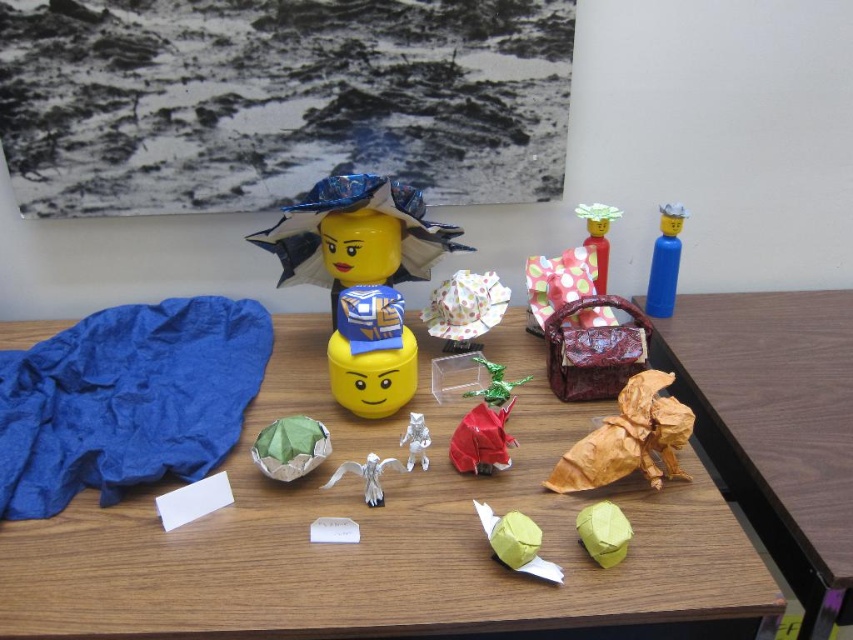
Is gold paper sculpture at right closer to the viewer compared to matte yellow paper ball at lower center?

That is True.

Is gold paper sculpture at right behind matte yellow paper ball at lower center?

No, gold paper sculpture at right is in front of matte yellow paper ball at lower center.

I want to click on gold paper sculpture at right, so pyautogui.click(x=776, y=426).

Locate an element on the screen. This screenshot has width=853, height=640. gold paper sculpture at right is located at coordinates (776, 426).

Does gold paper sculpture at right come in front of matte green paper at center?

Yes, gold paper sculpture at right is closer to the viewer.

Is point (798, 378) less distant than point (485, 513)?

No, (798, 378) is further to viewer.

Does point (827, 378) come in front of point (486, 532)?

No.

Where is `gold paper sculpture at right`? Image resolution: width=853 pixels, height=640 pixels. gold paper sculpture at right is located at coordinates (776, 426).

Does wooden table at center appear on the right side of metallic green dragon at center?

Incorrect, wooden table at center is not on the right side of metallic green dragon at center.

Which is in front, point (543, 620) or point (486, 400)?

Positioned in front is point (543, 620).

Is point (686, 541) behind point (524, 378)?

That is False.

Where is `wooden table at center`? wooden table at center is located at coordinates (378, 534).